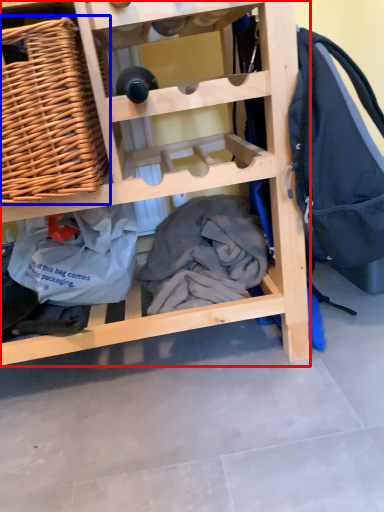
Question: Which point is closer to the camera, furniture (highlighted by a red box) or picnic basket (highlighted by a blue box)?

Choices:
 (A) furniture
 (B) picnic basket

Answer: (A)